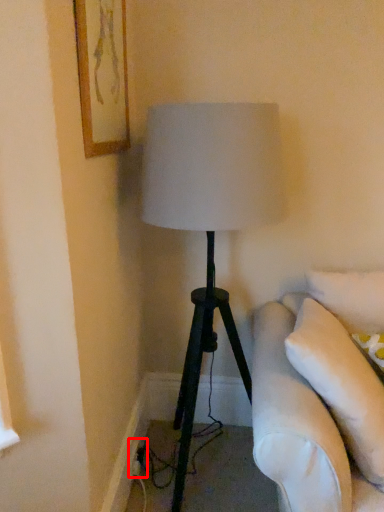
Question: In this image, where is electric outlet (annotated by the red box) located relative to picture frame?

Choices:
 (A) right
 (B) left

Answer: (A)